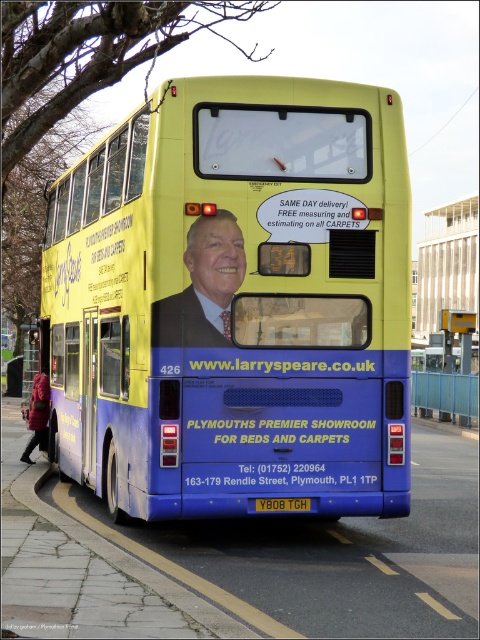
You are a delivery person standing next to the yellow matte bus at center and the smooth suit at center. You need to place a package on top of the taller object. Which object should you choose?

The yellow matte bus at center is much taller than the smooth suit at center, so you should place the package on top of the yellow matte bus at center.

You are a pedestrian standing on the sidewalk next to the yellow matte bus at center. You want to read the license plate number on the yellow metallic license plate at center. Is the license plate above or below the bus?

The yellow metallic license plate at center is below the yellow matte bus at center, so you need to look downward to see it.

You are a delivery person who needs to load a package onto the yellow matte bus at center. You have a smooth suit at center nearby. Which object should you interact with first to ensure the package fits properly?

The yellow matte bus at center is larger in size than smooth suit at center, so you should first check the dimensions of the yellow matte bus at center to ensure the package fits properly before handling the smooth suit at center.